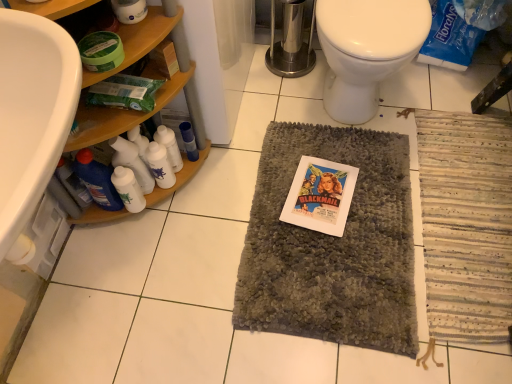
Identify the location of vacant space that is in between white plastic bottles at left, which is the 2th bottle in right-to-left order, and gray shaggy mat at center. The height and width of the screenshot is (384, 512). (225, 200).